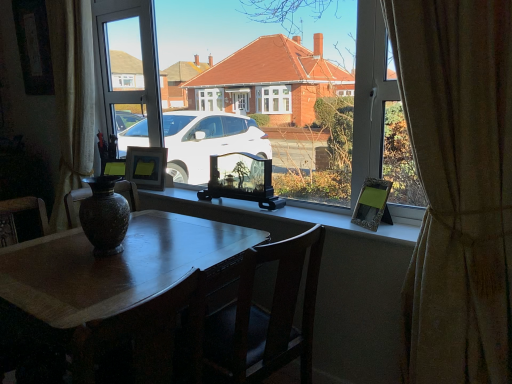
Locate an element on the screen. Image resolution: width=512 pixels, height=384 pixels. unoccupied area behind marbled stone vase at center is located at coordinates (136, 231).